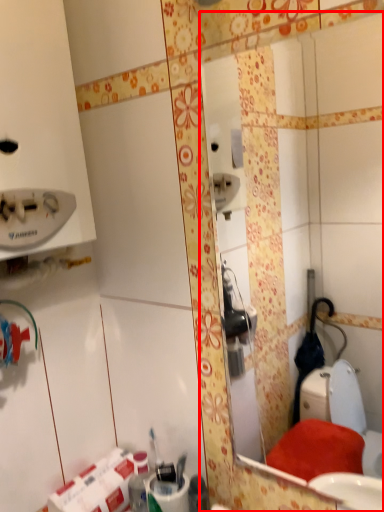
Question: From the image, what is the correct spatial relationship of mirror (annotated by the red box) in relation to toilet paper?

Choices:
 (A) right
 (B) left

Answer: (A)